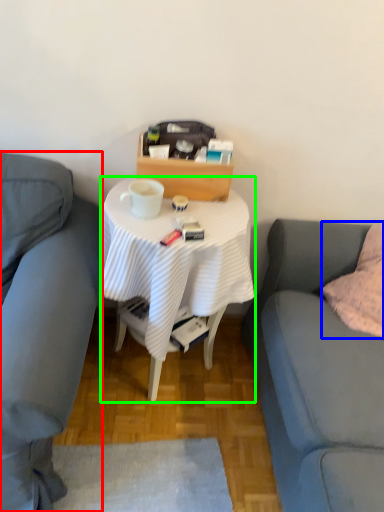
Question: Estimate the real-world distances between objects in this image. Which object is closer to studio couch (highlighted by a red box), pillow (highlighted by a blue box) or desk (highlighted by a green box)?

Choices:
 (A) pillow
 (B) desk

Answer: (B)